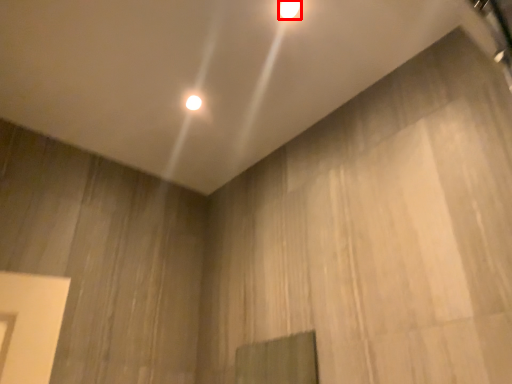
Question: Where is lamp (annotated by the red box) located in relation to lamp in the image?

Choices:
 (A) right
 (B) left

Answer: (A)